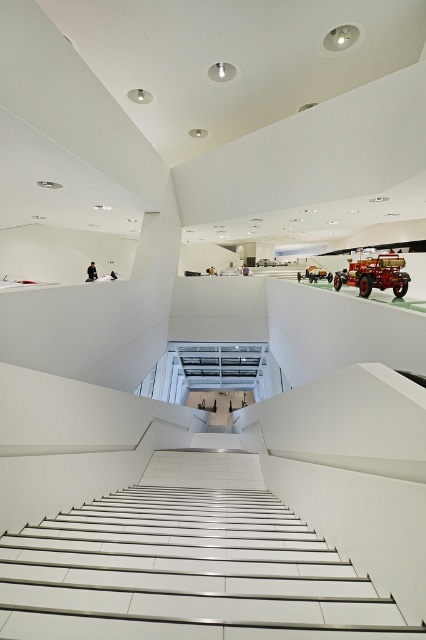
You are an art curator planning to move a sculpture from the lower level to the upper level. The sculpture is 1.8 meters tall. The white glossy stair at center has a lesser height compared to the shiny red fire truck at upper center. Can the sculpture pass through the staircase without tilting it vertically?

The white glossy stair at center has a lesser height compared to the shiny red fire truck at upper center. However, the height of the staircase itself isn t specified in the provided information. The sculpture s height is 1.8 meters, but without knowing the actual height clearance of the stairs, we cannot determine if it can pass through without tilting. Additional measurements are needed.

You are an art curator planning to move a large sculpture from the lower level to the upper level of the building. The sculpture is too tall to pass under the shiny red fire truck at upper center. Based on the scene, can you determine if the white glossy stair at center provides a clear path for moving the sculpture upwards without hitting the fire truck?

The white glossy stair at center is in front of the shiny red fire truck at upper center, meaning the fire truck is behind the staircase. Therefore, moving the sculpture up the stairs won not encounter the fire truck, so the path is clear.

You are standing at the bottom of the staircase in the museum. You need to reach the upper level where the exhibits are displayed. According to the image, where exactly is the white glossy stair at center located?

The white glossy stair at center is located at point 0.884 on the x axis and 0.441 on the y axis.